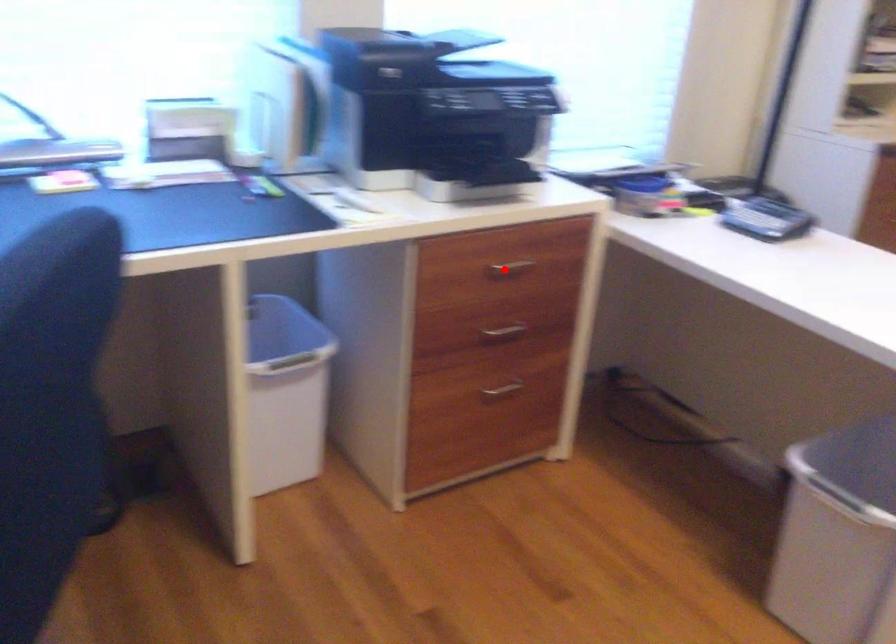
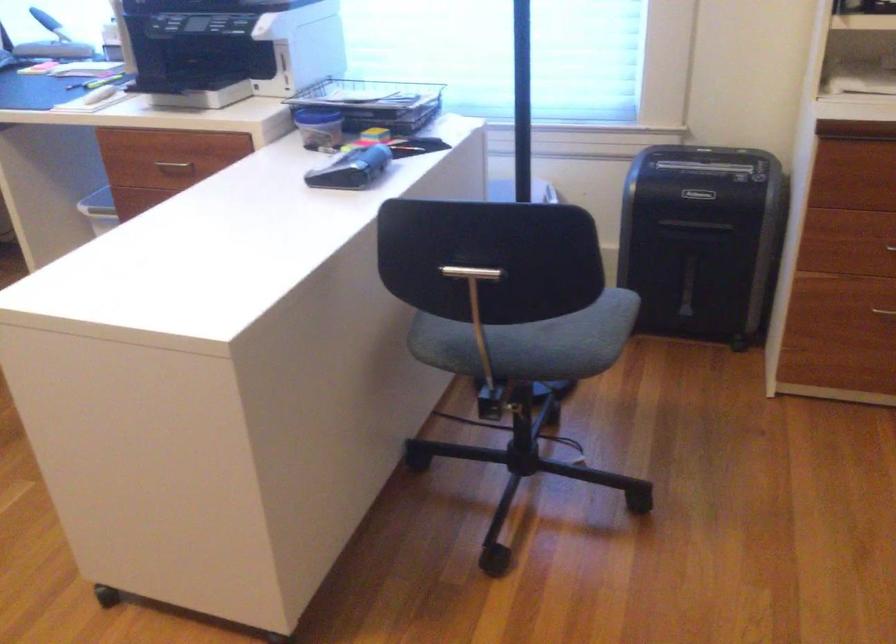
Question: A red point is marked in image1. In image2, is the corresponding 3D point closer to the camera or farther? Reply with the corresponding letter.

Choices:
 (A) The corresponding 3D point is closer.
 (B) The corresponding 3D point is farther.

Answer: (B)